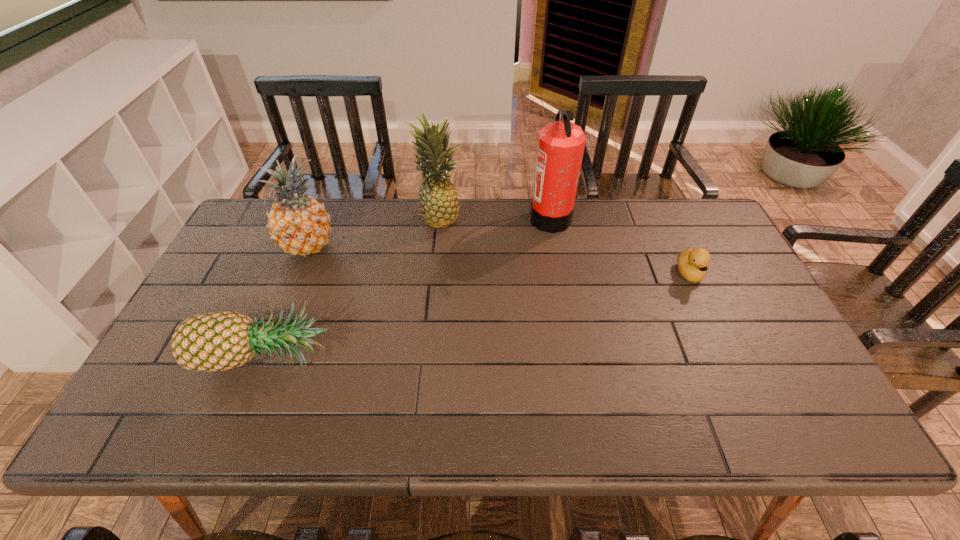
Locate an element on the screen. The width and height of the screenshot is (960, 540). vacant area located 0.280m on the front side of the fire extinguisher is located at coordinates (446, 217).

Image resolution: width=960 pixels, height=540 pixels. I want to click on free space located on the front of the rightmost pineapple, so click(x=428, y=323).

This screenshot has width=960, height=540. What are the coordinates of `free space located on the right of the third shortest object` in the screenshot? It's located at click(404, 246).

Find the location of a particular element. free space located 0.190m on the right of the shortest pineapple is located at coordinates (409, 354).

I want to click on free location located facing forward on the rightmost object, so click(x=718, y=337).

Find the location of a particular element. The height and width of the screenshot is (540, 960). fire extinguisher that is positioned at the far edge is located at coordinates (561, 144).

This screenshot has width=960, height=540. In order to click on object located at the right edge in this screenshot , I will do `click(692, 264)`.

Find the location of `object present at the far left corner`. object present at the far left corner is located at coordinates (298, 224).

The height and width of the screenshot is (540, 960). Find the location of `free space at the far edge of the desktop`. free space at the far edge of the desktop is located at coordinates point(361,205).

At what (x,y) coordinates should I click in order to perform the action: click on vacant area at the near edge of the desktop. Please return your answer as a coordinate pair (x, y). The height and width of the screenshot is (540, 960). Looking at the image, I should click on (256, 436).